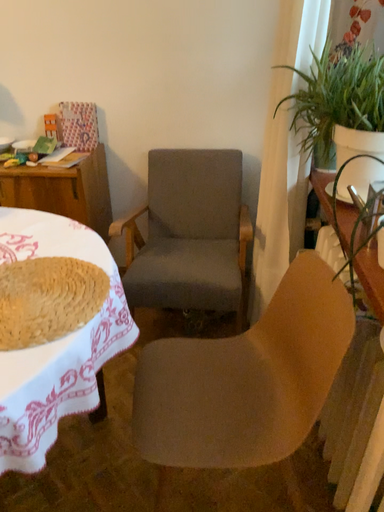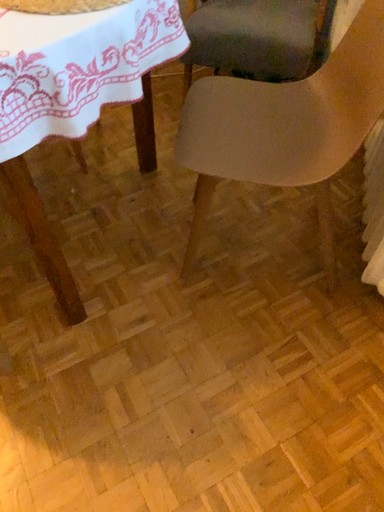
Question: How did the camera likely rotate when shooting the video?

Choices:
 (A) rotated downward
 (B) rotated upward

Answer: (A)